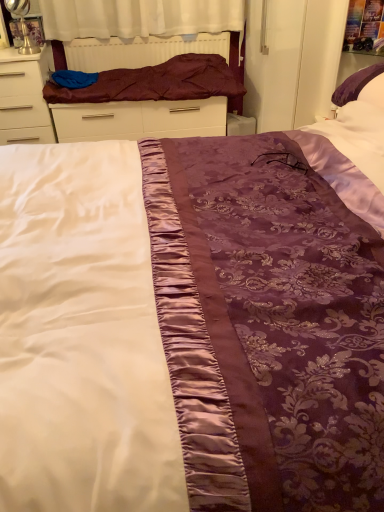
This screenshot has width=384, height=512. I want to click on white glossy chest of drawers at left, so click(24, 98).

Describe the element at coordinates (157, 82) in the screenshot. The width and height of the screenshot is (384, 512). I see `maroon satin blanket at upper left` at that location.

Where is `maroon satin bed frame at upper center`? Image resolution: width=384 pixels, height=512 pixels. maroon satin bed frame at upper center is located at coordinates (142, 92).

Considering their positions, is maroon satin blanket at upper left located in front of or behind white glossy chest of drawers at left?

In the image, maroon satin blanket at upper left appears behind white glossy chest of drawers at left.

Is maroon satin blanket at upper left beside white glossy chest of drawers at left?

No.

Is maroon satin blanket at upper left facing away from white glossy chest of drawers at left?

No, maroon satin blanket at upper left's orientation is not away from white glossy chest of drawers at left.

Considering the sizes of objects maroon satin bed frame at upper center and maroon satin blanket at upper left in the image provided, who is smaller, maroon satin bed frame at upper center or maroon satin blanket at upper left?

maroon satin bed frame at upper center is smaller.

Between maroon satin bed frame at upper center and maroon satin blanket at upper left, which one has larger width?

maroon satin blanket at upper left.

Image resolution: width=384 pixels, height=512 pixels. What are the coordinates of `bed frame on the right of maroon satin blanket at upper left` in the screenshot? It's located at (142, 92).

Is maroon satin bed frame at upper center at the left side of maroon satin blanket at upper left?

Incorrect, maroon satin bed frame at upper center is not on the left side of maroon satin blanket at upper left.

Which is less distant, (0, 57) or (234, 75)?

The point (0, 57) is more forward.

Considering the relative positions of white glossy chest of drawers at left and maroon satin bed frame at upper center in the image provided, is white glossy chest of drawers at left behind maroon satin bed frame at upper center?

No, it is not.

Is white glossy chest of drawers at left far from maroon satin bed frame at upper center?

No, there isn't a large distance between white glossy chest of drawers at left and maroon satin bed frame at upper center.

Looking at this image, between maroon satin blanket at upper left and maroon satin bed frame at upper center, which one has more height?

maroon satin bed frame at upper center.

Based on the photo, which object is further away from the camera taking this photo, maroon satin blanket at upper left or maroon satin bed frame at upper center?

maroon satin bed frame at upper center is more distant.

Does maroon satin blanket at upper left turn towards maroon satin bed frame at upper center?

No.

Which object is thinner, maroon satin blanket at upper left or maroon satin bed frame at upper center?

Thinner between the two is maroon satin bed frame at upper center.

Is white glossy chest of drawers at left next to maroon satin blanket at upper left?

No.

How much distance is there between white glossy chest of drawers at left and maroon satin blanket at upper left?

A distance of 41.56 centimeters exists between white glossy chest of drawers at left and maroon satin blanket at upper left.

Is point (27, 125) behind point (232, 97)?

No.

Who is smaller, white glossy chest of drawers at left or maroon satin blanket at upper left?

With smaller size is maroon satin blanket at upper left.

Which object is closer to the camera taking this photo, maroon satin bed frame at upper center or white glossy chest of drawers at left?

Positioned in front is white glossy chest of drawers at left.

From their relative heights in the image, would you say maroon satin bed frame at upper center is taller or shorter than white glossy chest of drawers at left?

maroon satin bed frame at upper center is shorter than white glossy chest of drawers at left.

Based on the photo, from the image's perspective, is maroon satin bed frame at upper center under white glossy chest of drawers at left?

No.

The width and height of the screenshot is (384, 512). In order to click on the chest of drawers below the maroon satin blanket at upper left (from a real-world perspective) in this screenshot , I will do `click(24, 98)`.

Locate an element on the screen. The height and width of the screenshot is (512, 384). bed frame that appears behind the maroon satin blanket at upper left is located at coordinates (142, 92).

Estimate the real-world distances between objects in this image. Which object is further from maroon satin bed frame at upper center, maroon satin blanket at upper left or white glossy chest of drawers at left?

The object further to maroon satin bed frame at upper center is white glossy chest of drawers at left.

Considering their positions, is maroon satin bed frame at upper center positioned further to maroon satin blanket at upper left than white glossy chest of drawers at left?

white glossy chest of drawers at left is further to maroon satin blanket at upper left.

From the image, which object appears to be farther from white glossy chest of drawers at left, maroon satin blanket at upper left or maroon satin bed frame at upper center?

maroon satin blanket at upper left is positioned further to the anchor white glossy chest of drawers at left.

When comparing their distances from white glossy chest of drawers at left, does maroon satin bed frame at upper center or maroon satin blanket at upper left seem closer?

maroon satin bed frame at upper center lies closer to white glossy chest of drawers at left than the other object.

Consider the image. Which object lies further to the anchor point maroon satin bed frame at upper center, white glossy chest of drawers at left or maroon satin blanket at upper left?

Based on the image, white glossy chest of drawers at left appears to be further to maroon satin bed frame at upper center.

Which object lies nearer to the anchor point maroon satin blanket at upper left, white glossy chest of drawers at left or maroon satin bed frame at upper center?

maroon satin bed frame at upper center.

The width and height of the screenshot is (384, 512). In order to click on blanket located between white glossy chest of drawers at left and maroon satin bed frame at upper center in the left-right direction in this screenshot , I will do `click(157, 82)`.